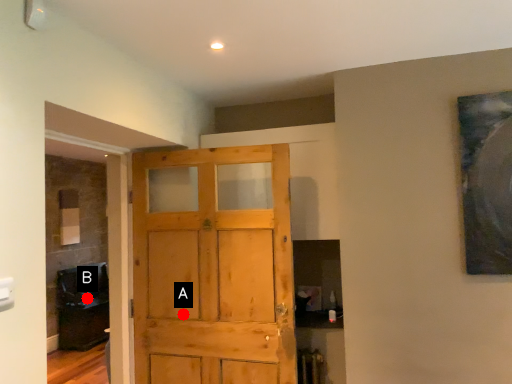
Question: Two points are circled on the image, labeled by A and B beside each circle. Among these points, which one is nearest to the camera?

Choices:
 (A) A is closer
 (B) B is closer

Answer: (A)